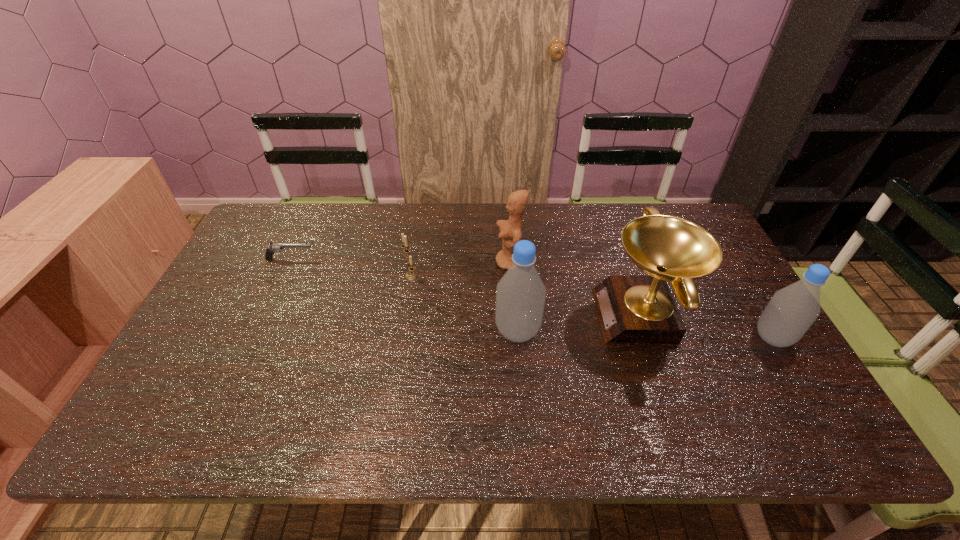
The image size is (960, 540). Identify the location of object located in the left edge section of the desktop. (x=274, y=247).

You are a GUI agent. You are given a task and a screenshot of the screen. Output one action in this format:
    pyautogui.click(x=<x>, y=<y>)
    Task: Click on the object at the right edge
    This screenshot has width=960, height=540.
    Given the screenshot: What is the action you would take?
    pyautogui.click(x=792, y=310)

Identify the location of vacant area at the far edge. This screenshot has height=540, width=960. (550, 231).

In the image, there is a desktop. Identify the location of vacant space at the near edge. (473, 399).

This screenshot has height=540, width=960. I want to click on vacant space at the left edge of the desktop, so click(x=203, y=322).

This screenshot has height=540, width=960. I want to click on free space at the right edge of the desktop, so click(739, 308).

Locate an element on the screen. The width and height of the screenshot is (960, 540). free space at the far left corner is located at coordinates (287, 234).

In the image, there is a desktop. What are the coordinates of `vacant region at the far right corner` in the screenshot? It's located at (673, 211).

This screenshot has height=540, width=960. Identify the location of unoccupied position between the left bottle and the leftmost object. (404, 295).

This screenshot has height=540, width=960. I want to click on empty location between the second shortest object and the leftmost object, so click(350, 267).